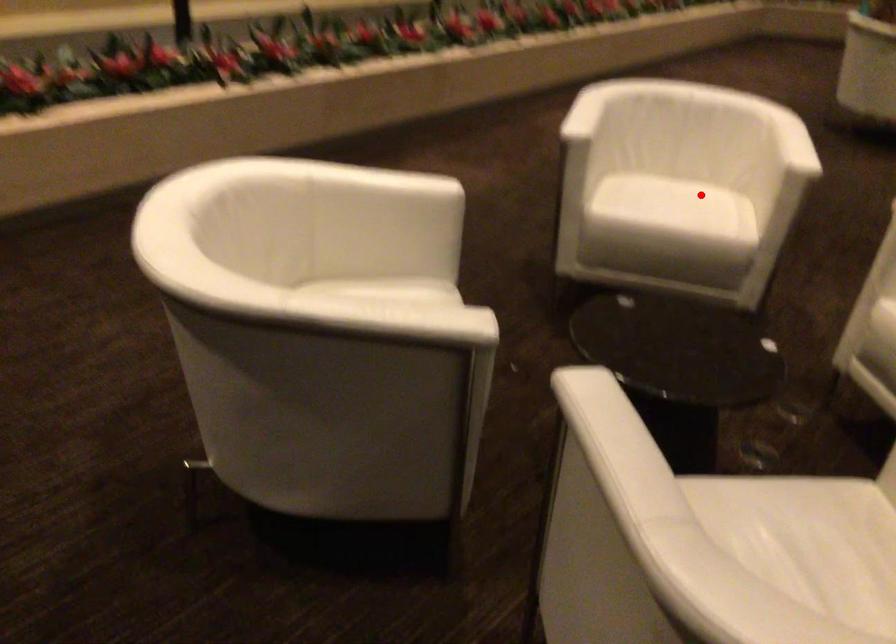
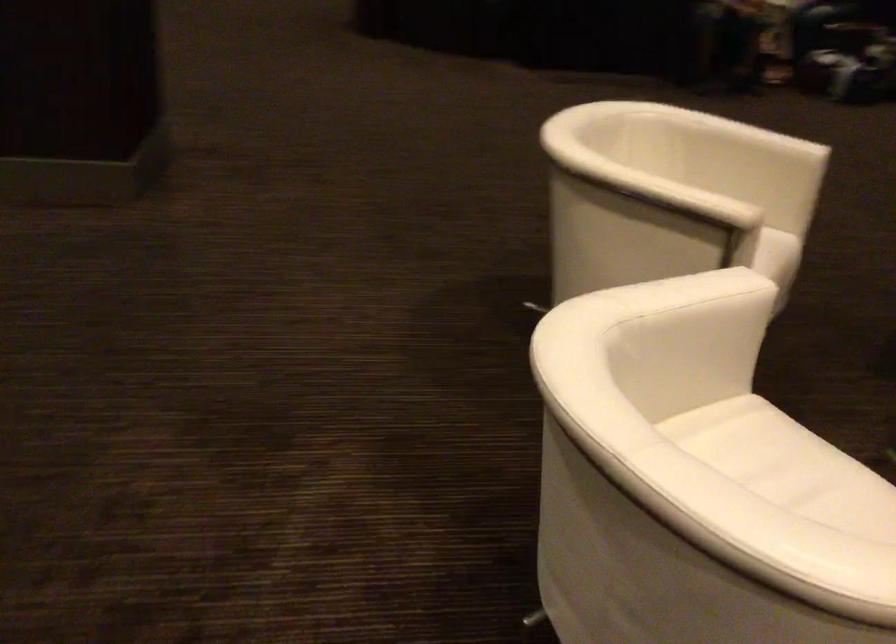
Question: I am providing you with two images of the same scene from different viewpoints. In image1, a red point is highlighted. Considering the same 3D point in image2, which of the following is correct?

Choices:
 (A) It is closer
 (B) It is farther

Answer: (A)